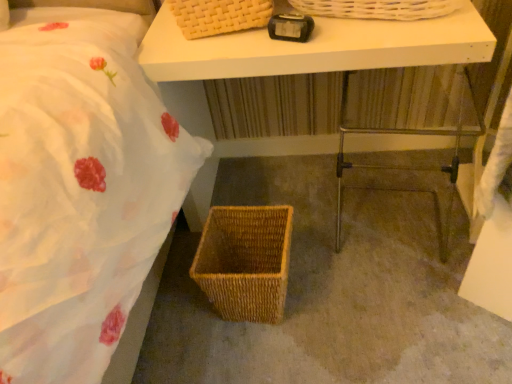
What are the coordinates of `free space in front of woven brown picnic basket at lower center` in the screenshot? It's located at (264, 359).